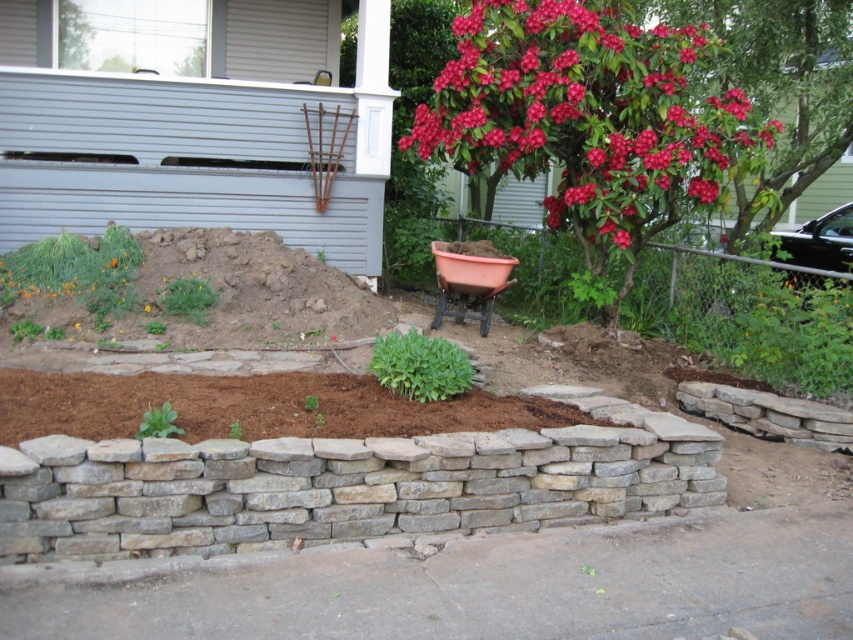
Question: Considering the relative positions of red glossy flower at upper right and brown mulch at center in the image provided, where is red glossy flower at upper right located with respect to brown mulch at center?

Choices:
 (A) right
 (B) left

Answer: (A)

Question: Does red glossy flower at upper right have a greater width compared to brown mulch at center?

Choices:
 (A) yes
 (B) no

Answer: (B)

Question: Does brown mulch at center have a lesser width compared to terracotta clay pot at center?

Choices:
 (A) no
 (B) yes

Answer: (A)

Question: Among these objects, which one is farthest from the camera?

Choices:
 (A) red glossy flower at upper right
 (B) terracotta clay pot at center

Answer: (B)

Question: Which point is farther to the camera?

Choices:
 (A) (505, 280)
 (B) (247, 440)

Answer: (A)

Question: Among these objects, which one is nearest to the camera?

Choices:
 (A) brown mulch at center
 (B) red glossy flower at upper right

Answer: (A)